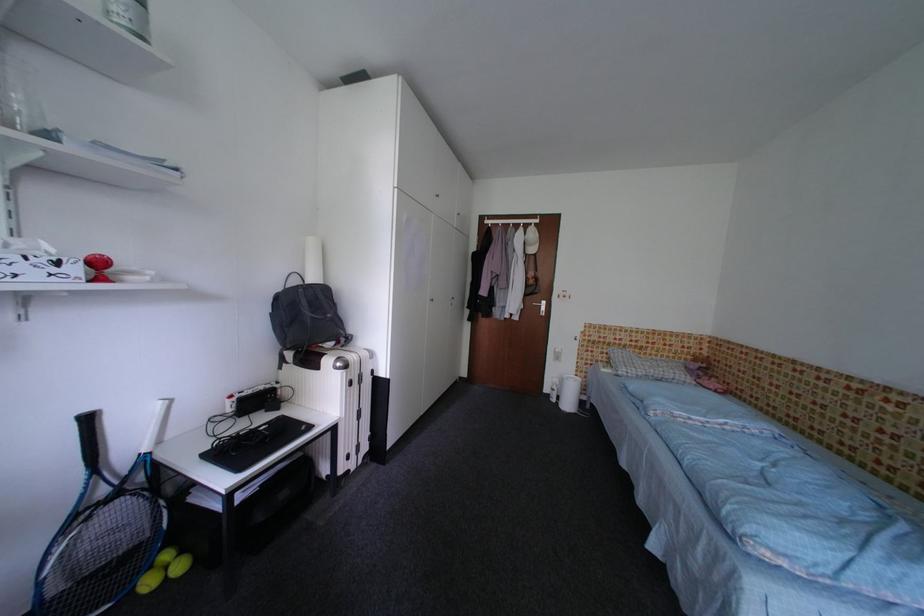
In order to click on cabinet door handle in this screenshot , I will do `click(452, 300)`.